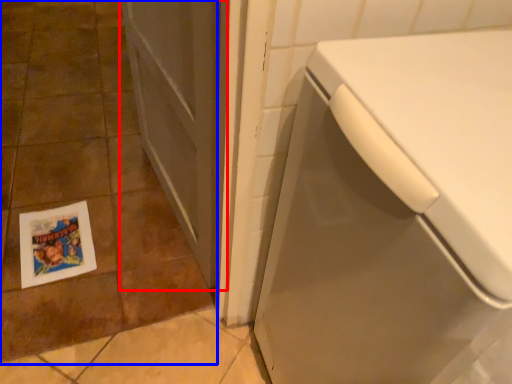
Question: Among these objects, which one is nearest to the camera, screen door (highlighted by a red box) or ceramic tile (highlighted by a blue box)?

Choices:
 (A) screen door
 (B) ceramic tile

Answer: (A)